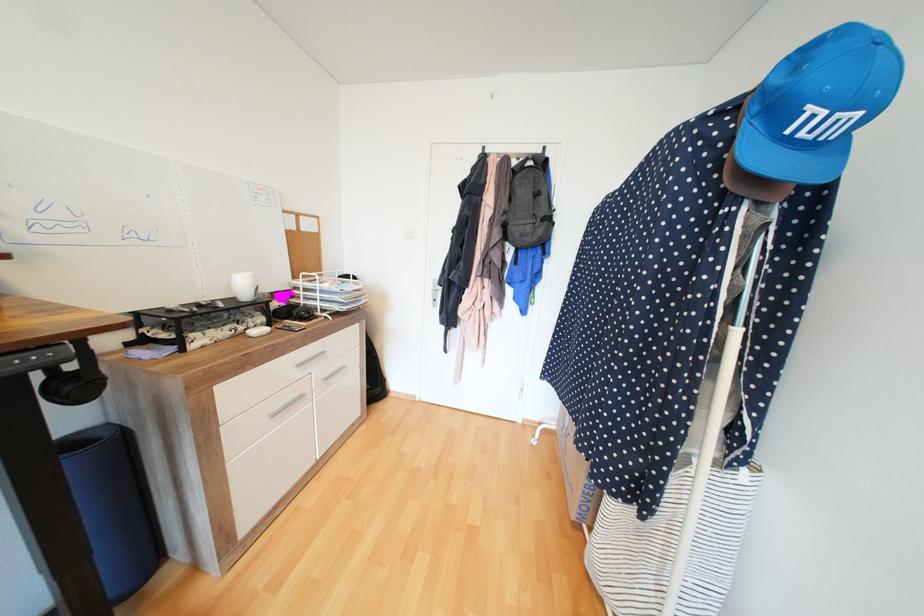
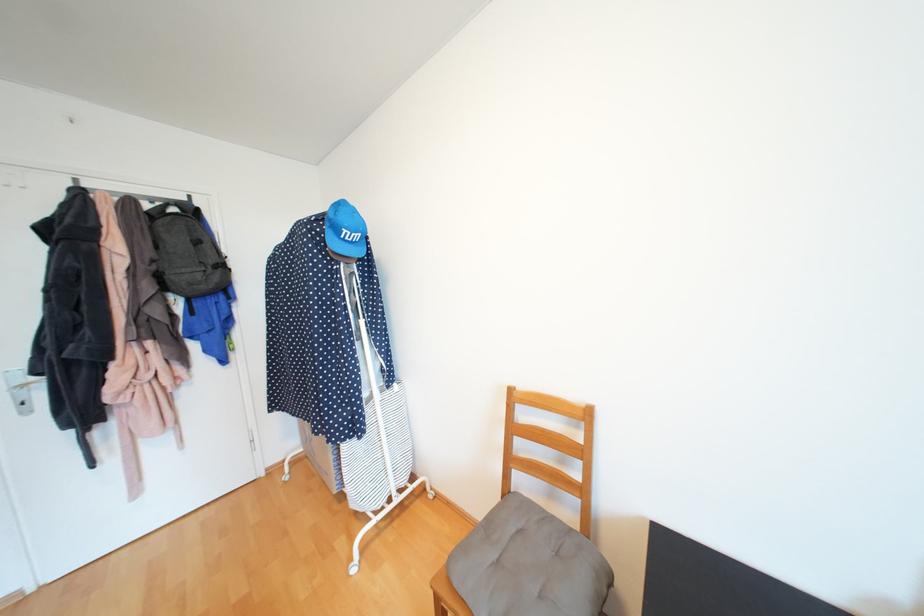
In the second image, find the point that corresponds to pixel 443 291 in the first image.

(30, 387)